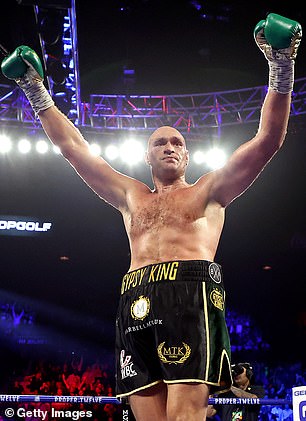
Locate an element on the screen. The height and width of the screenshot is (421, 306). chest is located at coordinates (164, 207), (233, 396).